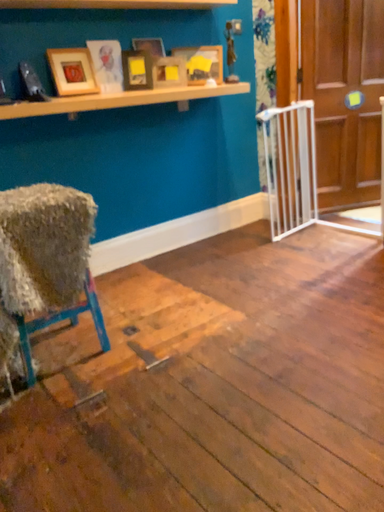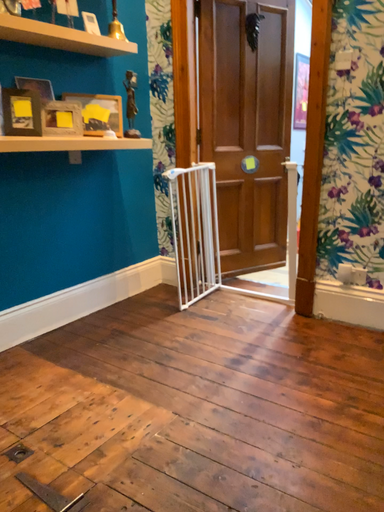
Question: How did the camera likely rotate when shooting the video?

Choices:
 (A) rotated upward
 (B) rotated downward

Answer: (A)